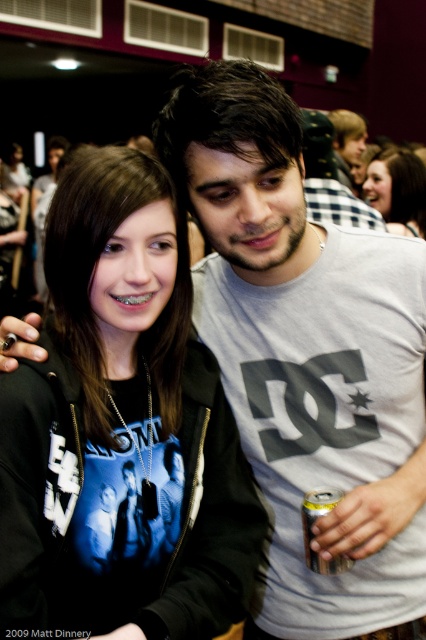
You are at a party and need to grab the silver metallic can at lower center without touching the matte black hoodie at upper right. Can you reach it?

The matte black hoodie at upper right is positioned on the right side of the silver metallic can at lower center, so you can reach the silver metallic can at lower center by moving around to the left side of the matte black hoodie at upper right to avoid contact.